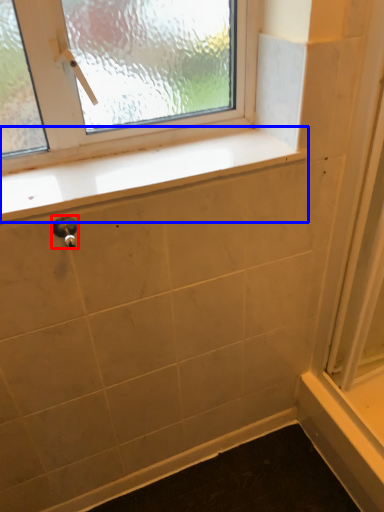
Question: Which object appears farthest to the camera in this image, door handle (highlighted by a red box) or window sill (highlighted by a blue box)?

Choices:
 (A) door handle
 (B) window sill

Answer: (B)